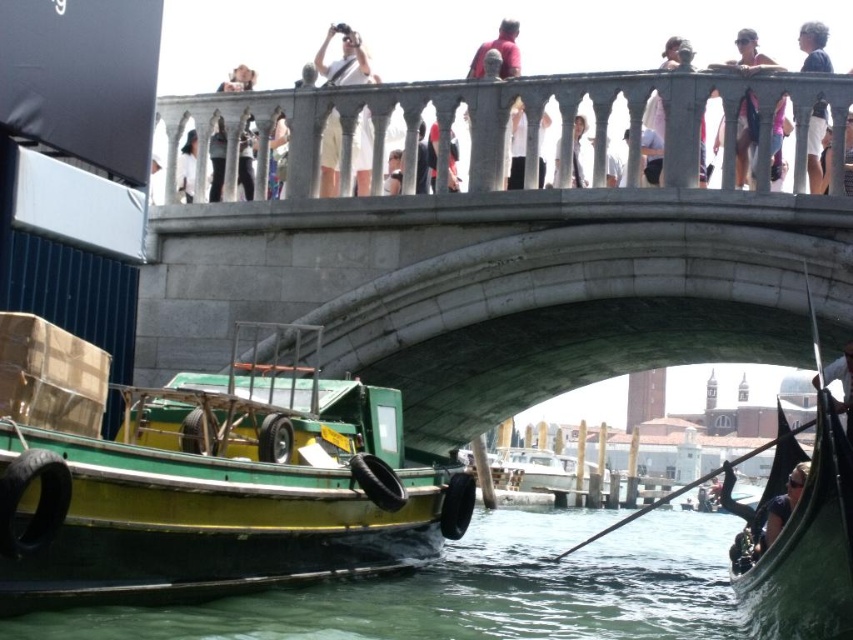
What is the color of the clothing item located at the coordinates point (343, 60) in the image?

The clothing item at point (343, 60) is a white cotton shirt at upper center.

You are a tourist standing on the stone bridge in Venice, Italy. You see a light brown leather jacket at upper center and a white fabric at upper center. If you want to pick up both items, which one would you reach first if they are both hanging from the bridge railing?

The light brown leather jacket at upper center and white fabric at upper center are 18.22 feet apart from each other. Since they are both hanging from the bridge railing, you would need to move along the railing to reach both items, but the question does not specify their order along the railing, so it cannot be determined which one you would reach first without additional information about their positions relative to each other along the railing.

You are a tourist standing on the stone bridge in Venice and notice two items at the upper center of the scene. The items are labeled as the white cotton shirt at upper center and the white fabric at upper center. Which of these two items is closer to you?

The white cotton shirt at upper center is closer to you since it is only 13.83 meters away from the white fabric at upper center, meaning it is nearer to your position on the bridge.